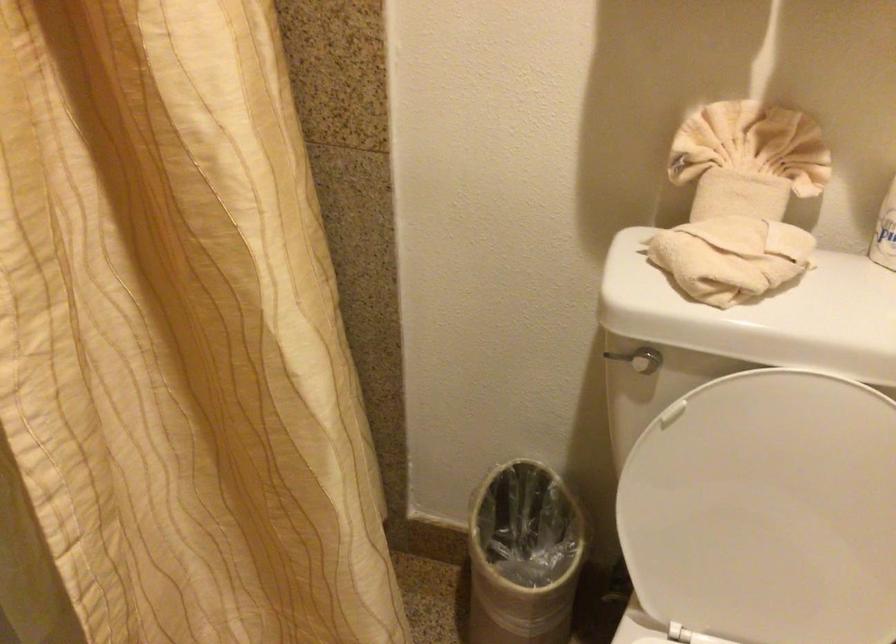
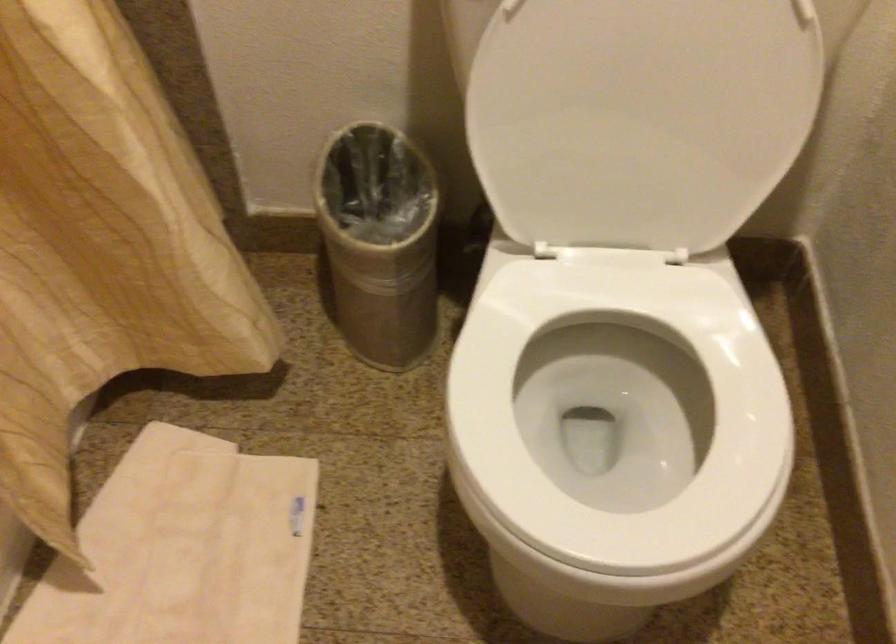
Find the pixel in the second image that matches (780,529) in the first image.

(640, 118)